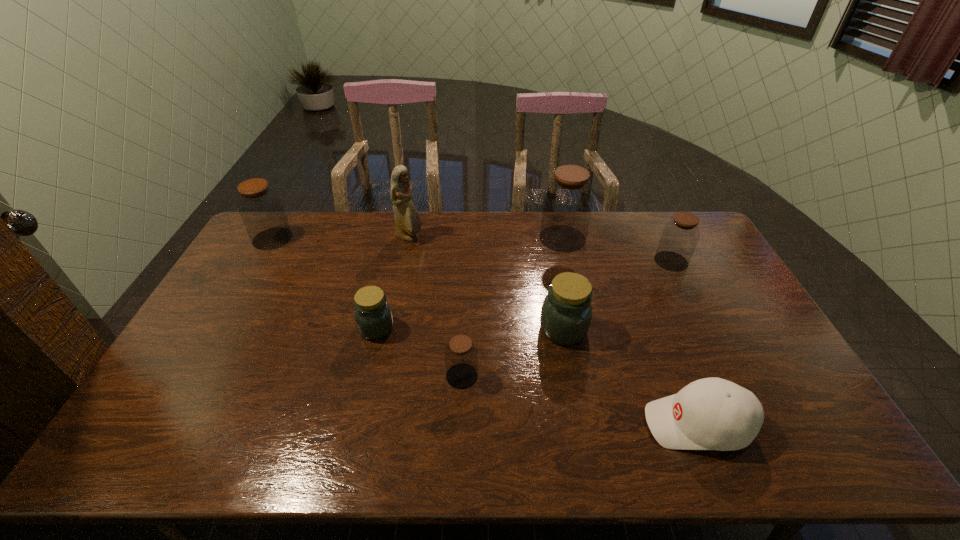
Image resolution: width=960 pixels, height=540 pixels. I want to click on figurine, so click(x=408, y=222).

Locate an element on the screen. the second brown jar from right to left is located at coordinates (568, 200).

Locate an element on the screen. the biggest brown jar is located at coordinates (568, 200).

You are a GUI agent. You are given a task and a screenshot of the screen. Output one action in this format:
    pyautogui.click(x=<x>, y=<y>)
    Task: Click on the leftmost jar
    The width and height of the screenshot is (960, 540).
    Given the screenshot: What is the action you would take?
    pyautogui.click(x=261, y=209)

Find the location of a particular element. This screenshot has width=960, height=540. the leftmost brown jar is located at coordinates (261, 209).

Where is `the rightmost brown jar`? This screenshot has height=540, width=960. the rightmost brown jar is located at coordinates (679, 238).

Locate an element on the screen. This screenshot has height=540, width=960. the rightmost jar is located at coordinates (679, 238).

Locate an element on the screen. Image resolution: width=960 pixels, height=540 pixels. the right green jar is located at coordinates (566, 313).

Where is `the third jar from left to right`? This screenshot has width=960, height=540. the third jar from left to right is located at coordinates (461, 356).

In order to click on the smallest brown jar in this screenshot , I will do `click(461, 356)`.